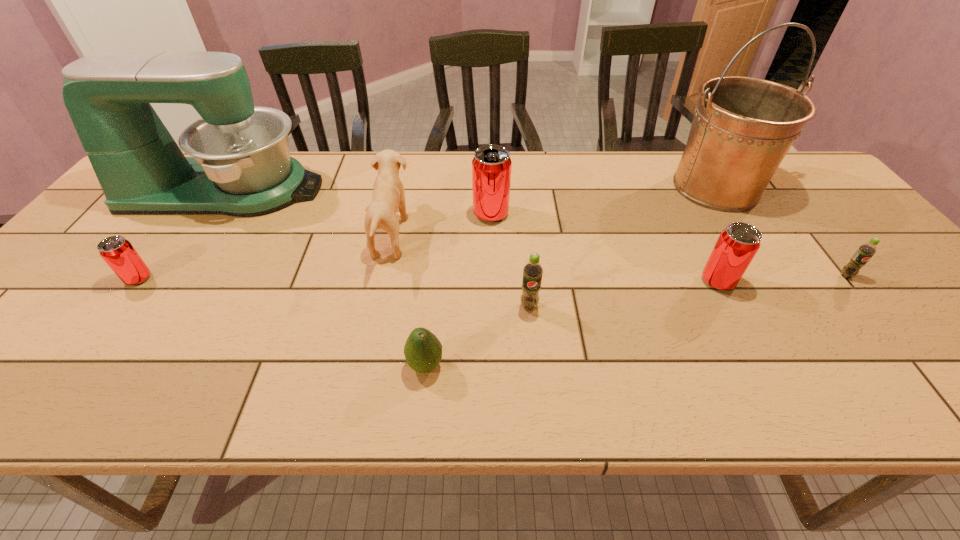
Where is `vacant region between the puppy and the second tallest object`? This screenshot has height=540, width=960. vacant region between the puppy and the second tallest object is located at coordinates (308, 213).

At what (x,y) coordinates should I click in order to perform the action: click on empty space between the fourth soda from left to right and the sixth object from right to left. Please return your answer as a coordinate pair (x, y). This screenshot has width=960, height=540. Looking at the image, I should click on (572, 323).

Locate an element on the screen. The image size is (960, 540). unoccupied position between the beige puppy and the leftmost red soda can is located at coordinates (265, 257).

Locate an element on the screen. This screenshot has width=960, height=540. free area in between the puppy and the smallest red soda can is located at coordinates (265, 257).

The height and width of the screenshot is (540, 960). What are the coordinates of `free space between the eighth shortest object and the puppy` in the screenshot? It's located at (308, 213).

Image resolution: width=960 pixels, height=540 pixels. Identify the location of vacant area that lies between the fifth object from right to left and the mixer. (358, 202).

Select which object is the third closest to the beige puppy. Please provide its 2D coordinates. Your answer should be formatted as a tuple, i.e. [(x, y)], where the tuple contains the x and y coordinates of a point satisfying the conditions above.

[(423, 351)]

Select which object appears as the sixth closest to the rightmost object. Please provide its 2D coordinates. Your answer should be formatted as a tuple, i.e. [(x, y)], where the tuple contains the x and y coordinates of a point satisfying the conditions above.

[(388, 195)]

Select which soda is the closest to the second tallest object. Please provide its 2D coordinates. Your answer should be formatted as a tuple, i.e. [(x, y)], where the tuple contains the x and y coordinates of a point satisfying the conditions above.

[(118, 252)]

Image resolution: width=960 pixels, height=540 pixels. In order to click on soda that is the fourth closest one to the bucket in this screenshot , I will do tap(532, 271).